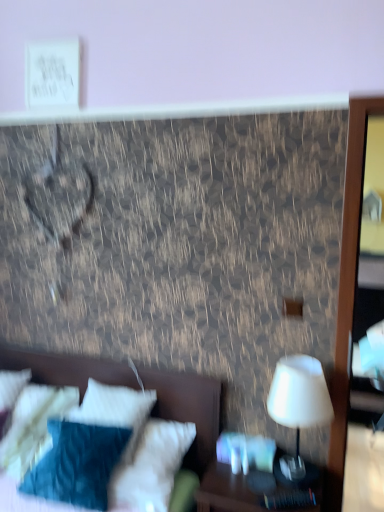
What is the approximate width of white matte table lamp at right?

white matte table lamp at right is 9.04 inches wide.

Identify the location of wooden nightstand at lower right. The image size is (384, 512). (227, 490).

Where is `white matte table lamp at right`? white matte table lamp at right is located at coordinates (298, 403).

Which is behind, white matte table lamp at right or wooden nightstand at lower right?

white matte table lamp at right is behind.

Based on the photo, from a real-world perspective, which object rests below the other?

wooden nightstand at lower right is physically lower.

Which of these two, white matte table lamp at right or wooden nightstand at lower right, stands shorter?

Standing shorter between the two is wooden nightstand at lower right.

Considering the relative positions of white matte table lamp at right and wooden nightstand at lower right in the image provided, is white matte table lamp at right to the right of wooden nightstand at lower right from the viewer's perspective?

Correct, you'll find white matte table lamp at right to the right of wooden nightstand at lower right.

Considering the sizes of objects white soft pillow at lower left, which is the 1th pillow in right-to-left order, and wooden nightstand at lower right in the image provided, who is thinner, white soft pillow at lower left, which is the 1th pillow in right-to-left order, or wooden nightstand at lower right?

Thinner between the two is white soft pillow at lower left, which is the 1th pillow in right-to-left order.

In the image, is white soft pillow at lower left, which is the 1th pillow in right-to-left order, positioned in front of or behind wooden nightstand at lower right?

Clearly, white soft pillow at lower left, which is the 1th pillow in right-to-left order, is behind wooden nightstand at lower right.

Are white soft pillow at lower left, which is the 1th pillow in right-to-left order, and wooden nightstand at lower right located far from each other?

No, there isn't a large distance between white soft pillow at lower left, which is the 1th pillow in right-to-left order, and wooden nightstand at lower right.

From a real-world perspective, between white soft pillow at lower left, which is the 1th pillow in right-to-left order, and wooden nightstand at lower right, who is vertically higher?

white soft pillow at lower left, which is the 1th pillow in right-to-left order, from a real-world perspective.

Based on the photo, considering the relative sizes of white soft pillow at lower left, the 2th pillow positioned from the right, and white soft bed at lower left in the image provided, is white soft pillow at lower left, the 2th pillow positioned from the right, shorter than white soft bed at lower left?

Correct, white soft pillow at lower left, the 2th pillow positioned from the right, is not as tall as white soft bed at lower left.

Are white soft pillow at lower left, marked as the first pillow in a left-to-right arrangement, and white soft bed at lower left far apart?

No, white soft pillow at lower left, marked as the first pillow in a left-to-right arrangement, is in close proximity to white soft bed at lower left.

Where is `bed above the white soft pillow at lower left, the 2th pillow positioned from the right (from the image's perspective)`? bed above the white soft pillow at lower left, the 2th pillow positioned from the right (from the image's perspective) is located at coordinates (189, 406).

How much distance is there between white soft pillow at lower left, the 2th pillow positioned from the right, and white soft bed at lower left?

A distance of 10.69 inches exists between white soft pillow at lower left, the 2th pillow positioned from the right, and white soft bed at lower left.

Is white soft bed at lower left at the left side of white soft pillow at lower left, which is the second pillow in left-to-right order?

Indeed, white soft bed at lower left is positioned on the left side of white soft pillow at lower left, which is the second pillow in left-to-right order.

Considering the sizes of objects white soft bed at lower left and white soft pillow at lower left, which is the second pillow in left-to-right order, in the image provided, who is taller, white soft bed at lower left or white soft pillow at lower left, which is the second pillow in left-to-right order,?

white soft bed at lower left is taller.

Locate an element on the screen. The image size is (384, 512). bed lying below the white soft pillow at lower left, which is the second pillow in left-to-right order (from the image's perspective) is located at coordinates (189, 406).

From the image's perspective, who appears lower, white soft bed at lower left or white soft pillow at lower left, which is the 1th pillow in right-to-left order?

white soft bed at lower left, from the image's perspective.

Which of these two, white matte table lamp at right or white soft pillow at lower left, which is the 1th pillow in right-to-left order, stands shorter?

Standing shorter between the two is white soft pillow at lower left, which is the 1th pillow in right-to-left order.

Is white matte table lamp at right further to camera compared to white soft pillow at lower left, which is the 1th pillow in right-to-left order?

No, white matte table lamp at right is closer to the viewer.

How many degrees apart are the facing directions of white matte table lamp at right and white soft pillow at lower left, which is the second pillow in left-to-right order?

4.53 degrees.

Where is `table lamp lying in front of the white soft pillow at lower left, which is the second pillow in left-to-right order`? table lamp lying in front of the white soft pillow at lower left, which is the second pillow in left-to-right order is located at coordinates (298, 403).

Is the depth of white soft pillow at lower left, marked as the first pillow in a left-to-right arrangement, greater than that of white matte table lamp at right?

That is True.

Where is `the 2nd pillow below the white matte table lamp at right (from a real-world perspective)`? This screenshot has width=384, height=512. the 2nd pillow below the white matte table lamp at right (from a real-world perspective) is located at coordinates (33, 426).

From the image's perspective, is white soft pillow at lower left, which is the second pillow in left-to-right order, located above or below white matte table lamp at right?

Based on their image positions, white soft pillow at lower left, which is the second pillow in left-to-right order, is located beneath white matte table lamp at right.

In the scene shown: Can you tell me how much white soft pillow at lower left, which is the second pillow in left-to-right order, and white matte table lamp at right differ in facing direction?

The angular difference between white soft pillow at lower left, which is the second pillow in left-to-right order, and white matte table lamp at right is 4.53 degrees.

Is white soft pillow at lower left, which is the 1th pillow in right-to-left order, facing away from white matte table lamp at right?

No, white matte table lamp at right is not at the back of white soft pillow at lower left, which is the 1th pillow in right-to-left order.

Is white soft pillow at lower left, which is the second pillow in left-to-right order, bigger or smaller than white matte table lamp at right?

In the image, white soft pillow at lower left, which is the second pillow in left-to-right order, appears to be larger than white matte table lamp at right.

Where is `nightstand on the left of the white matte table lamp at right`? This screenshot has height=512, width=384. nightstand on the left of the white matte table lamp at right is located at coordinates (227, 490).

You are a GUI agent. You are given a task and a screenshot of the screen. Output one action in this format:
    pyautogui.click(x=<x>, y=<y>)
    Task: Click on the nightstand below the white soft pillow at lower left, which is the second pillow in left-to-right order (from the image's perspective)
    The image size is (384, 512).
    Given the screenshot: What is the action you would take?
    pyautogui.click(x=227, y=490)

Looking at the image, which one is located further to white soft bed at lower left, white soft pillow at lower left, which is the second pillow in left-to-right order, or white soft pillow at lower left, marked as the first pillow in a left-to-right arrangement?

white soft pillow at lower left, marked as the first pillow in a left-to-right arrangement, is further to white soft bed at lower left.

Looking at the image, which one is located further to white soft pillow at lower left, marked as the first pillow in a left-to-right arrangement, white soft bed at lower left or white matte table lamp at right?

white matte table lamp at right is further to white soft pillow at lower left, marked as the first pillow in a left-to-right arrangement.

Looking at the image, which one is located further to white soft pillow at lower left, marked as the first pillow in a left-to-right arrangement, wooden nightstand at lower right or white matte table lamp at right?

white matte table lamp at right is further to white soft pillow at lower left, marked as the first pillow in a left-to-right arrangement.

Looking at the image, which one is located further to white soft pillow at lower left, the 2th pillow positioned from the right, wooden nightstand at lower right or white soft bed at lower left?

wooden nightstand at lower right is positioned further to the anchor white soft pillow at lower left, the 2th pillow positioned from the right.

From the image, which object appears to be nearer to wooden nightstand at lower right, white soft pillow at lower left, which is the second pillow in left-to-right order, or white matte table lamp at right?

white matte table lamp at right is closer to wooden nightstand at lower right.

Considering their positions, is white soft pillow at lower left, marked as the first pillow in a left-to-right arrangement, positioned closer to white soft pillow at lower left, which is the 1th pillow in right-to-left order, than white soft bed at lower left?

white soft bed at lower left.

Based on their spatial positions, is white matte table lamp at right or wooden nightstand at lower right further from white soft pillow at lower left, which is the 1th pillow in right-to-left order?

Based on the image, white matte table lamp at right appears to be further to white soft pillow at lower left, which is the 1th pillow in right-to-left order.

From the image, which object appears to be farther from white soft bed at lower left, white soft pillow at lower left, the 2th pillow positioned from the right, or white matte table lamp at right?

white matte table lamp at right is further to white soft bed at lower left.

The height and width of the screenshot is (512, 384). What are the coordinates of `bed between white soft pillow at lower left, the 2th pillow positioned from the right, and white matte table lamp at right, in the horizontal direction` in the screenshot? It's located at (189, 406).

At what (x,y) coordinates should I click in order to perform the action: click on pillow between white soft pillow at lower left, the 2th pillow positioned from the right, and wooden nightstand at lower right. Please return your answer as a coordinate pair (x, y). Looking at the image, I should click on (115, 411).

You are a GUI agent. You are given a task and a screenshot of the screen. Output one action in this format:
    pyautogui.click(x=<x>, y=<y>)
    Task: Click on the pillow located between white soft bed at lower left and white soft pillow at lower left, marked as the first pillow in a left-to-right arrangement, in the depth direction
    
    Given the screenshot: What is the action you would take?
    pyautogui.click(x=115, y=411)

In order to click on pillow situated between white soft pillow at lower left, marked as the first pillow in a left-to-right arrangement, and white matte table lamp at right from left to right in this screenshot , I will do `click(115, 411)`.